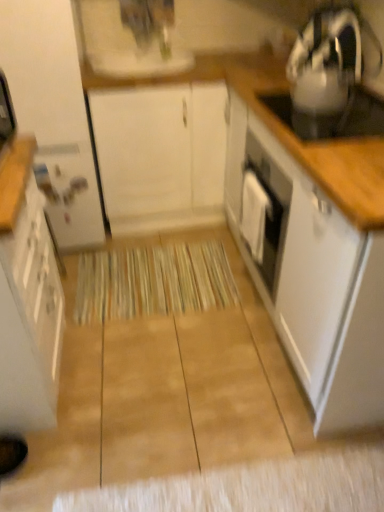
What do you see at coordinates (153, 281) in the screenshot? The image size is (384, 512). I see `beige textured mat at center` at bounding box center [153, 281].

This screenshot has height=512, width=384. What do you see at coordinates (326, 61) in the screenshot?
I see `metallic silver kettle at upper right` at bounding box center [326, 61].

I want to click on white glossy sink at upper center, so coord(141,62).

What do you see at coordinates (53, 113) in the screenshot? I see `white glossy cabinet at left, acting as the fourth cabinetry starting from the right` at bounding box center [53, 113].

At what (x,y) coordinates should I click in order to perform the action: click on white glossy cabinet at left, which is the second cabinetry from left to right. Please return your answer as a coordinate pair (x, y). The image size is (384, 512). Looking at the image, I should click on (27, 298).

Image resolution: width=384 pixels, height=512 pixels. In order to click on beige textured mat at center in this screenshot , I will do `click(153, 281)`.

Is white glossy cabinet at right, arranged as the first cabinetry when viewed from the right, to the right of beige textured mat at center from the viewer's perspective?

Correct, you'll find white glossy cabinet at right, arranged as the first cabinetry when viewed from the right, to the right of beige textured mat at center.

Considering the sizes of objects white glossy cabinet at right, which ranks as the 4th cabinetry in left-to-right order, and beige textured mat at center in the image provided, who is wider, white glossy cabinet at right, which ranks as the 4th cabinetry in left-to-right order, or beige textured mat at center?

beige textured mat at center is wider.

From a real-world perspective, who is located lower, white glossy cabinet at right, which ranks as the 4th cabinetry in left-to-right order, or beige textured mat at center?

In real-world perspective, beige textured mat at center is lower.

Looking at this image, from the image's perspective, does white glossy cabinet at right, which ranks as the 4th cabinetry in left-to-right order, appear higher than beige textured mat at center?

Yes, from the image's perspective, white glossy cabinet at right, which ranks as the 4th cabinetry in left-to-right order, is above beige textured mat at center.

Does point (367, 374) lie behind point (26, 430)?

No, it is in front of (26, 430).

Considering their positions, is white glossy cabinet at right, arranged as the first cabinetry when viewed from the right, located in front of or behind white glossy cabinet at left, which is the second cabinetry from left to right?

white glossy cabinet at right, arranged as the first cabinetry when viewed from the right, is behind white glossy cabinet at left, which is the second cabinetry from left to right.

Find the location of a particular element. the 2nd cabinetry counting from the right side of the white glossy cabinet at left, the third cabinetry from the right is located at coordinates (309, 274).

In the scene shown: How much distance is there between white glossy cabinet at right, arranged as the first cabinetry when viewed from the right, and white glossy cabinet at left, the third cabinetry from the right?

white glossy cabinet at right, arranged as the first cabinetry when viewed from the right, and white glossy cabinet at left, the third cabinetry from the right, are 35.94 inches apart.

Which object is closer to the camera, metallic silver kettle at upper right or white glossy cabinet at left, the third cabinetry from the right?

white glossy cabinet at left, the third cabinetry from the right, is closer to the camera.

From the image's perspective, is metallic silver kettle at upper right over white glossy cabinet at left, which is the second cabinetry from left to right?

Indeed, from the image's perspective, metallic silver kettle at upper right is shown above white glossy cabinet at left, which is the second cabinetry from left to right.

Would you say metallic silver kettle at upper right is to the left or to the right of white glossy cabinet at left, the third cabinetry from the right, in the picture?

In the image, metallic silver kettle at upper right appears on the right side of white glossy cabinet at left, the third cabinetry from the right.

From the image's perspective, which one is positioned lower, white glossy cabinet at right, which ranks as the 4th cabinetry in left-to-right order, or white glossy cabinet at left, which ranks as the 1th cabinetry in left-to-right order?

white glossy cabinet at right, which ranks as the 4th cabinetry in left-to-right order.

Is white glossy cabinet at right, which ranks as the 4th cabinetry in left-to-right order, in contact with white glossy cabinet at left, which ranks as the 1th cabinetry in left-to-right order?

white glossy cabinet at right, which ranks as the 4th cabinetry in left-to-right order, and white glossy cabinet at left, which ranks as the 1th cabinetry in left-to-right order, are not in contact.

Considering the relative sizes of white glossy cabinet at right, arranged as the first cabinetry when viewed from the right, and white glossy cabinet at left, which ranks as the 1th cabinetry in left-to-right order, in the image provided, is white glossy cabinet at right, arranged as the first cabinetry when viewed from the right, bigger than white glossy cabinet at left, which ranks as the 1th cabinetry in left-to-right order,?

Incorrect, white glossy cabinet at right, arranged as the first cabinetry when viewed from the right, is not larger than white glossy cabinet at left, which ranks as the 1th cabinetry in left-to-right order.

Considering the sizes of objects white glossy cabinet at right, which ranks as the 4th cabinetry in left-to-right order, and white glossy cabinet at left, acting as the fourth cabinetry starting from the right, in the image provided, who is taller, white glossy cabinet at right, which ranks as the 4th cabinetry in left-to-right order, or white glossy cabinet at left, acting as the fourth cabinetry starting from the right,?

white glossy cabinet at left, acting as the fourth cabinetry starting from the right.

Between white matte cabinet at center, the 2th cabinetry when ordered from right to left, and white glossy cabinet at right, arranged as the first cabinetry when viewed from the right, which one has larger width?

With larger width is white matte cabinet at center, the 2th cabinetry when ordered from right to left.

Is the surface of white matte cabinet at center, the 2th cabinetry when ordered from right to left, in direct contact with white glossy cabinet at right, arranged as the first cabinetry when viewed from the right?

No.

From their relative heights in the image, would you say white matte cabinet at center, the 2th cabinetry when ordered from right to left, is taller or shorter than white glossy cabinet at right, arranged as the first cabinetry when viewed from the right?

Considering their sizes, white matte cabinet at center, the 2th cabinetry when ordered from right to left, has more height than white glossy cabinet at right, arranged as the first cabinetry when viewed from the right.

Which point is more forward, (139, 265) or (359, 62)?

Positioned in front is point (359, 62).

Is beige textured mat at center shorter than metallic silver kettle at upper right?

Correct, beige textured mat at center is not as tall as metallic silver kettle at upper right.

Is beige textured mat at center inside the boundaries of metallic silver kettle at upper right, or outside?

beige textured mat at center is not inside metallic silver kettle at upper right, it's outside.

This screenshot has width=384, height=512. What are the coordinates of `kitchen appliance that is on the right side of beige textured mat at center` in the screenshot? It's located at (326, 61).

From a real-world perspective, which is physically above, beige textured mat at center or white glossy cabinet at left, acting as the fourth cabinetry starting from the right?

white glossy cabinet at left, acting as the fourth cabinetry starting from the right.

Considering the relative sizes of beige textured mat at center and white glossy cabinet at left, which ranks as the 1th cabinetry in left-to-right order, in the image provided, is beige textured mat at center smaller than white glossy cabinet at left, which ranks as the 1th cabinetry in left-to-right order,?

Yes, beige textured mat at center is smaller than white glossy cabinet at left, which ranks as the 1th cabinetry in left-to-right order.

Considering the sizes of objects beige textured mat at center and white glossy cabinet at left, which ranks as the 1th cabinetry in left-to-right order, in the image provided, who is shorter, beige textured mat at center or white glossy cabinet at left, which ranks as the 1th cabinetry in left-to-right order,?

With less height is beige textured mat at center.

Would you say beige textured mat at center is outside white glossy cabinet at left, acting as the fourth cabinetry starting from the right?

beige textured mat at center lies outside white glossy cabinet at left, acting as the fourth cabinetry starting from the right,'s area.

The image size is (384, 512). In order to click on the 3rd cabinetry in front when counting from the beige textured mat at center in this screenshot , I will do `click(309, 274)`.

Identify the location of the 1st cabinetry behind when counting from the white glossy cabinet at left, which is the second cabinetry from left to right. (x=309, y=274).

Estimate the real-world distances between objects in this image. Which object is further from white glossy cabinet at left, which is the second cabinetry from left to right, white glossy sink at upper center or beige textured mat at center?

white glossy sink at upper center lies further to white glossy cabinet at left, which is the second cabinetry from left to right, than the other object.

Looking at the image, which one is located further to metallic silver kettle at upper right, beige textured mat at center or white glossy cabinet at left, acting as the fourth cabinetry starting from the right?

The object further to metallic silver kettle at upper right is white glossy cabinet at left, acting as the fourth cabinetry starting from the right.

When comparing their distances from metallic silver kettle at upper right, does white matte cabinet at center, acting as the third cabinetry starting from the left, or white glossy cabinet at left, which ranks as the 1th cabinetry in left-to-right order, seem closer?

Among the two, white matte cabinet at center, acting as the third cabinetry starting from the left, is located nearer to metallic silver kettle at upper right.

Looking at the image, which one is located further to white matte cabinet at center, the 2th cabinetry when ordered from right to left, metallic silver kettle at upper right or white glossy cabinet at right, arranged as the first cabinetry when viewed from the right?

white glossy cabinet at right, arranged as the first cabinetry when viewed from the right, is positioned further to the anchor white matte cabinet at center, the 2th cabinetry when ordered from right to left.

From the picture: Estimate the real-world distances between objects in this image. Which object is closer to white glossy sink at upper center, white glossy cabinet at left, which is the second cabinetry from left to right, or white matte cabinet at center, the 2th cabinetry when ordered from right to left?

The object closer to white glossy sink at upper center is white matte cabinet at center, the 2th cabinetry when ordered from right to left.

Which object lies further to the anchor point white glossy cabinet at left, the third cabinetry from the right, white glossy cabinet at right, arranged as the first cabinetry when viewed from the right, or white glossy cabinet at left, which ranks as the 1th cabinetry in left-to-right order?

white glossy cabinet at right, arranged as the first cabinetry when viewed from the right.

From the image, which object appears to be nearer to white matte cabinet at center, acting as the third cabinetry starting from the left, white glossy cabinet at right, which ranks as the 4th cabinetry in left-to-right order, or white glossy cabinet at left, acting as the fourth cabinetry starting from the right?

white glossy cabinet at left, acting as the fourth cabinetry starting from the right, is closer to white matte cabinet at center, acting as the third cabinetry starting from the left.

Estimate the real-world distances between objects in this image. Which object is further from white glossy cabinet at right, arranged as the first cabinetry when viewed from the right, white glossy cabinet at left, the third cabinetry from the right, or metallic silver kettle at upper right?

white glossy cabinet at left, the third cabinetry from the right, is positioned further to the anchor white glossy cabinet at right, arranged as the first cabinetry when viewed from the right.

You are a GUI agent. You are given a task and a screenshot of the screen. Output one action in this format:
    pyautogui.click(x=<x>, y=<y>)
    Task: Click on the mat between white glossy cabinet at left, which is the second cabinetry from left to right, and white glossy cabinet at right, which ranks as the 4th cabinetry in left-to-right order
    This screenshot has height=512, width=384.
    Given the screenshot: What is the action you would take?
    pyautogui.click(x=153, y=281)

You are a GUI agent. You are given a task and a screenshot of the screen. Output one action in this format:
    pyautogui.click(x=<x>, y=<y>)
    Task: Click on the kitchen appliance situated between white glossy cabinet at left, acting as the fourth cabinetry starting from the right, and white glossy cabinet at right, which ranks as the 4th cabinetry in left-to-right order, from left to right
    
    Given the screenshot: What is the action you would take?
    pyautogui.click(x=326, y=61)

Locate an element on the screen. This screenshot has height=512, width=384. mat situated between white glossy cabinet at left, which ranks as the 1th cabinetry in left-to-right order, and white glossy cabinet at right, which ranks as the 4th cabinetry in left-to-right order, from left to right is located at coordinates (153, 281).

You are a GUI agent. You are given a task and a screenshot of the screen. Output one action in this format:
    pyautogui.click(x=<x>, y=<y>)
    Task: Click on the kitchen appliance between white glossy sink at upper center and white glossy cabinet at right, which ranks as the 4th cabinetry in left-to-right order, in the horizontal direction
    
    Given the screenshot: What is the action you would take?
    pyautogui.click(x=326, y=61)